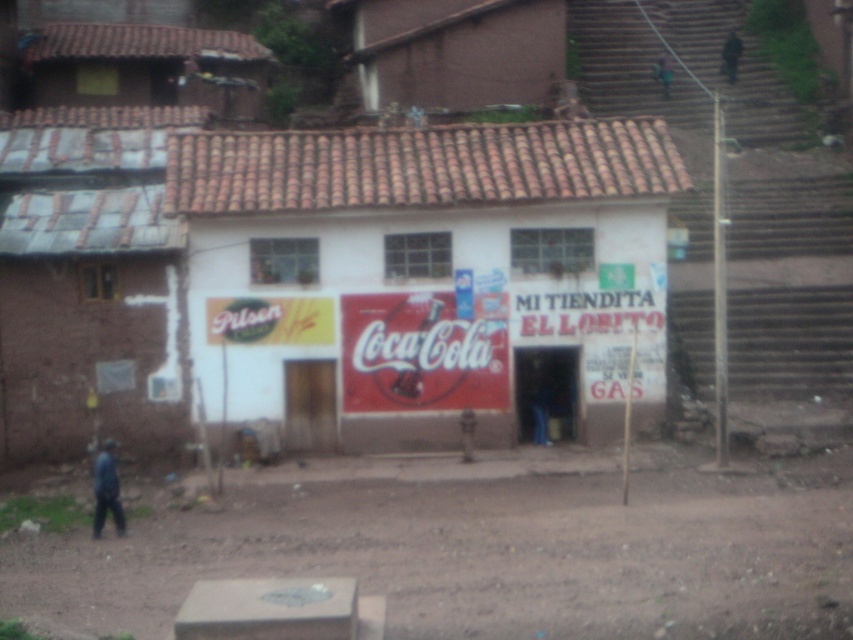
You are standing in front of the building and want to touch both the white painted wall at center and the dark blue fabric at lower left. Which one do you need to reach out further to touch?

You need to reach out further to touch the dark blue fabric at lower left because the white painted wall at center is closer to you, while the dark blue fabric at lower left is farther away.

You are a delivery person with a cart that is 15 feet long. You need to park your cart between the white painted wall at center and the brown dirt field at lower center. Is there enough space to park your cart without overlapping either the wall or the dirt field?

Answer: The distance between the white painted wall at center and the brown dirt field at lower center is 14.67 feet. Since the cart is 15 feet long, it is slightly longer than the available space. Therefore, the cart cannot be parked between them without overlapping either the wall or the dirt field.